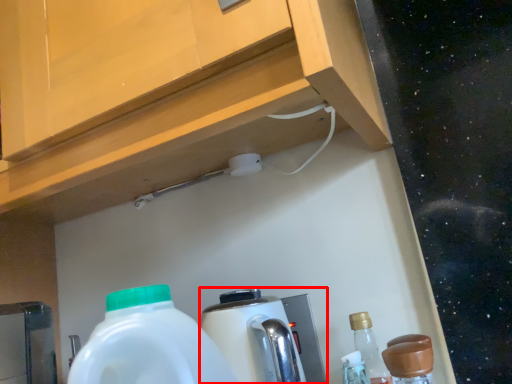
Question: From the image's perspective, what is the correct spatial relationship of coffee machine (annotated by the red box) in relation to bottle?

Choices:
 (A) above
 (B) below

Answer: (A)